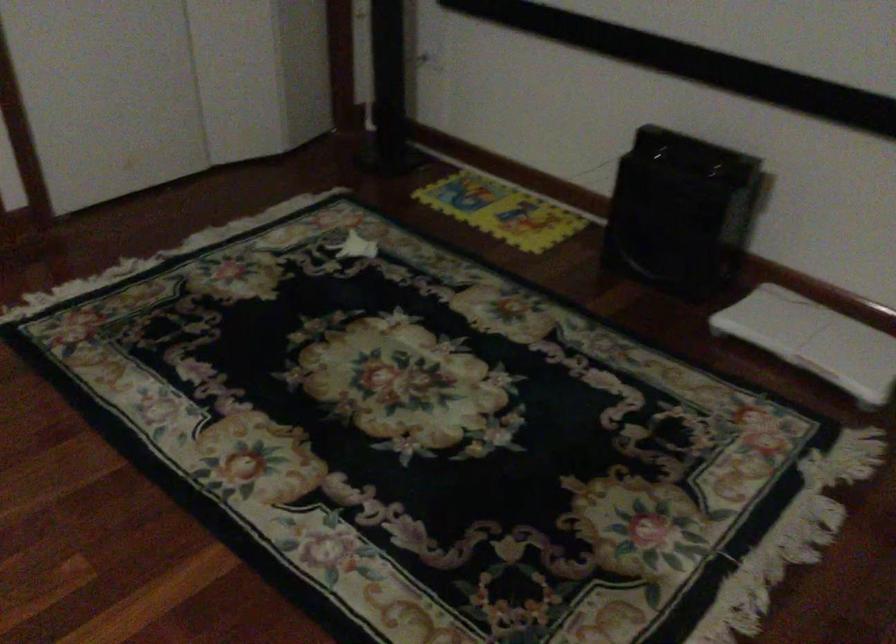
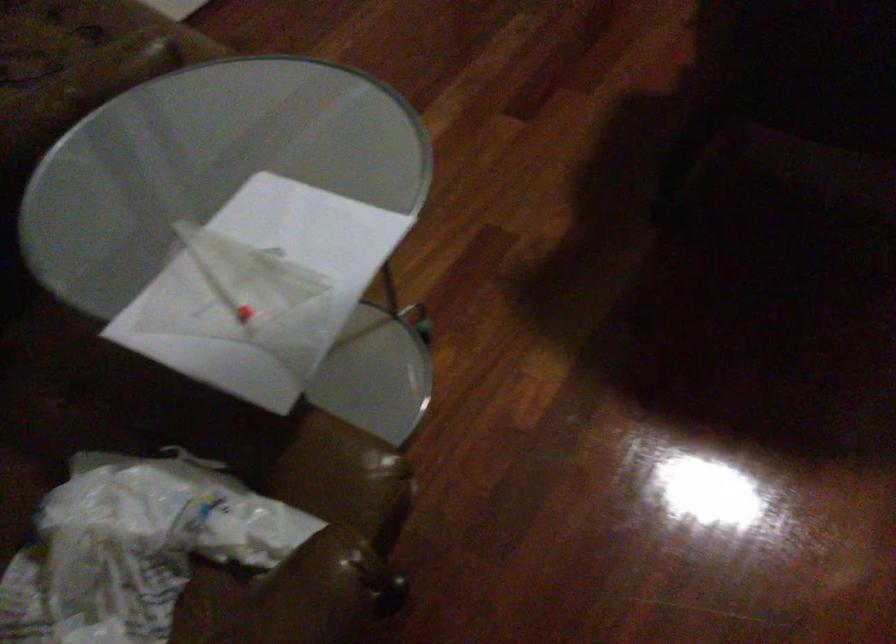
Question: In a continuous first-person perspective shot, in which direction is the camera moving?

Choices:
 (A) Left
 (B) Right
 (C) Forward
 (D) Backward

Answer: (A)